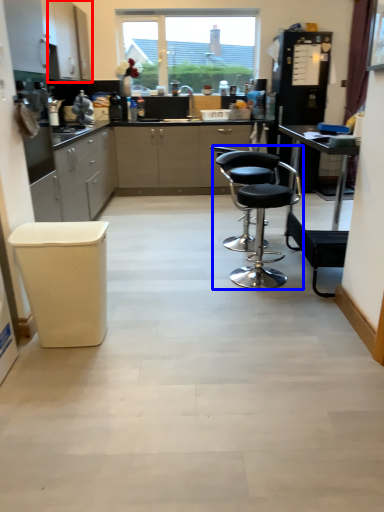
Question: Which of the following is the farthest to the observer, cabinetry (highlighted by a red box) or chair (highlighted by a blue box)?

Choices:
 (A) cabinetry
 (B) chair

Answer: (A)